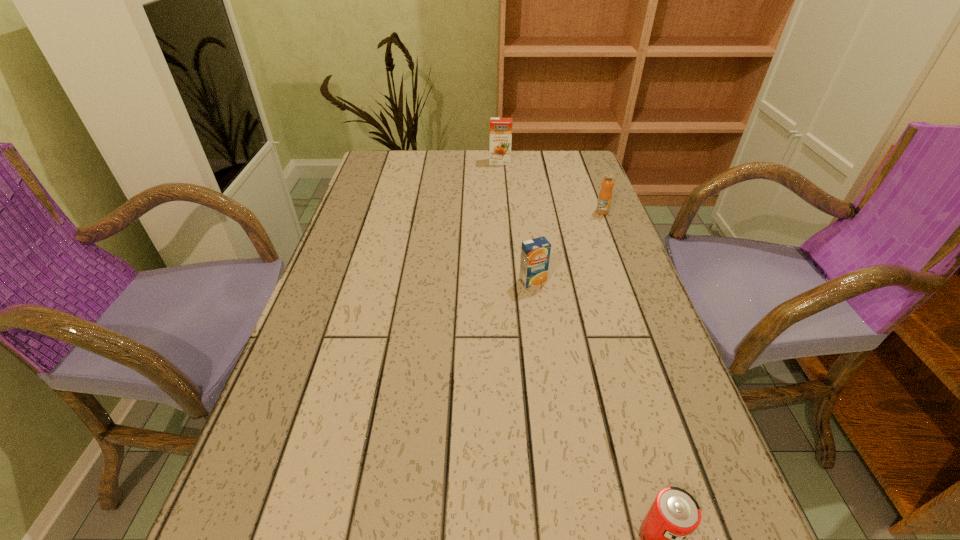
Where is `the farthest orange_juice`? The width and height of the screenshot is (960, 540). the farthest orange_juice is located at coordinates (500, 128).

Find the location of a particular element. The width and height of the screenshot is (960, 540). the tallest orange_juice is located at coordinates (500, 128).

The image size is (960, 540). I want to click on the rightmost orange_juice, so click(x=605, y=195).

This screenshot has width=960, height=540. Identify the location of the rightmost object. (605, 195).

The height and width of the screenshot is (540, 960). In order to click on the nearest orange_juice in this screenshot , I will do `click(535, 254)`.

I want to click on free space located 0.380m on the front of the tallest orange_juice, so click(505, 232).

Find the location of `vacant space located on the front label of the rightmost object`. vacant space located on the front label of the rightmost object is located at coordinates (630, 285).

Where is `free space located on the right of the third farthest object`? The image size is (960, 540). free space located on the right of the third farthest object is located at coordinates (636, 281).

Where is `object that is at the far edge`? object that is at the far edge is located at coordinates (500, 128).

The height and width of the screenshot is (540, 960). What are the coordinates of `object at the right edge` in the screenshot? It's located at (605, 195).